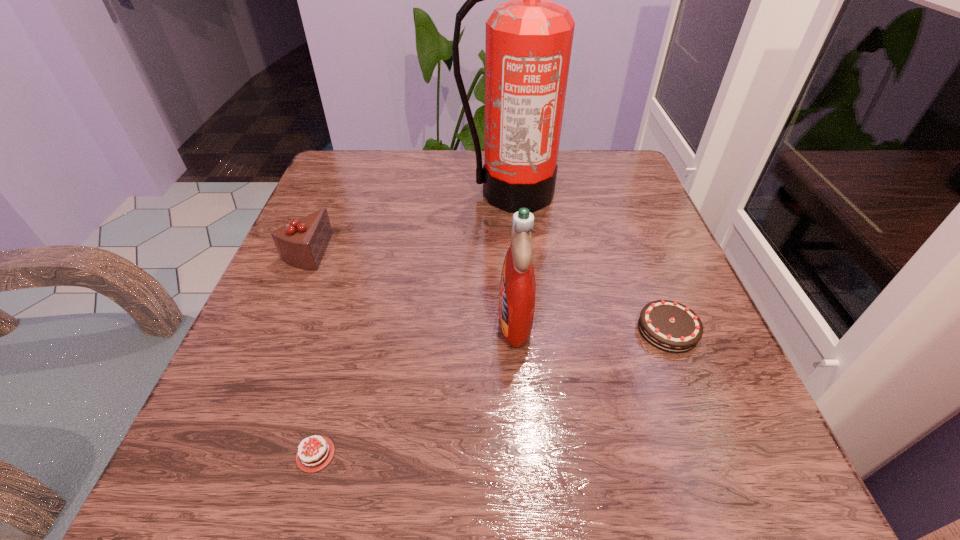
You are a GUI agent. You are given a task and a screenshot of the screen. Output one action in this format:
    pyautogui.click(x=<x>, y=<y>)
    Task: Click on the farthest object
    
    Given the screenshot: What is the action you would take?
    pyautogui.click(x=529, y=39)

Identify the location of the tallest object. This screenshot has height=540, width=960. (529, 39).

Identify the location of the fourth shortest object. (517, 293).

At what (x,y) coordinates should I click in order to perform the action: click on the tallest chocolate cake. Please return your answer as a coordinate pair (x, y). Looking at the image, I should click on (302, 243).

The width and height of the screenshot is (960, 540). In order to click on the second farthest object in this screenshot , I will do `click(302, 243)`.

This screenshot has height=540, width=960. In order to click on the second farthest chocolate cake in this screenshot , I will do `click(669, 326)`.

Find the location of a particular element. The height and width of the screenshot is (540, 960). the second tallest chocolate cake is located at coordinates (669, 326).

Locate an element on the screen. This screenshot has height=540, width=960. the shortest object is located at coordinates (311, 458).

In order to click on the nearest chocolate cake in this screenshot , I will do `click(311, 458)`.

The height and width of the screenshot is (540, 960). I want to click on vacant space located on the front side of the tallest object, so click(516, 249).